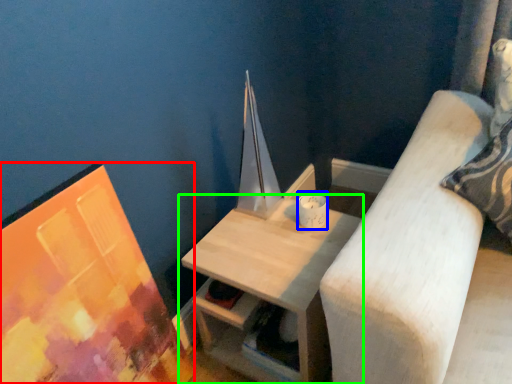
Question: Estimate the real-world distances between objects in this image. Which object is closer to picture frame (highlighted by a red box), candle holder (highlighted by a blue box) or table (highlighted by a green box)?

Choices:
 (A) candle holder
 (B) table

Answer: (B)